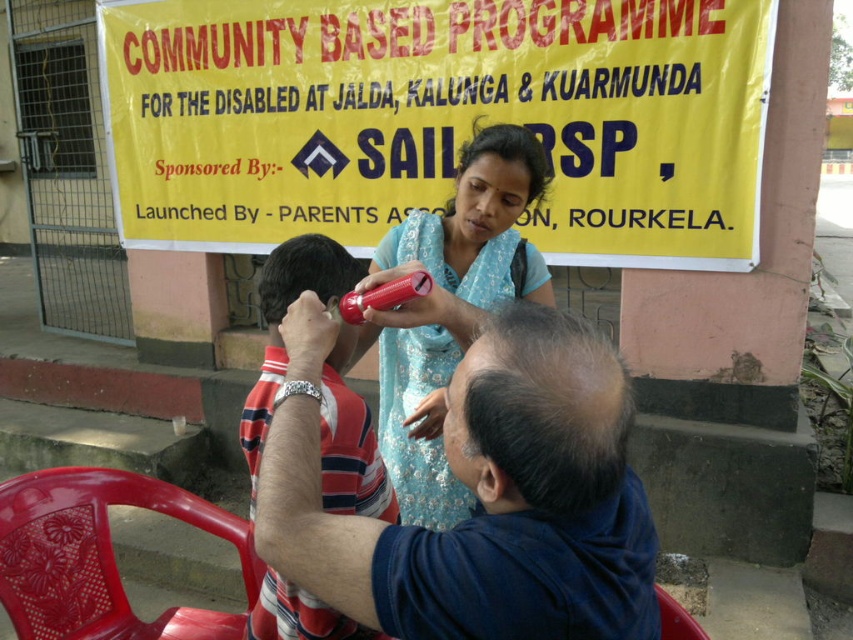
You are a healthcare worker setting up a station for a health screening event. You have a smooth plastic comb at center and a plastic chair at lower right. Which item should you place closer to the edge of the table to ensure it doesn not fall off?

The plastic chair at lower right should be placed closer to the edge because the smooth plastic comb at center might be wider and thus more stable if placed near the edge, reducing the risk of it falling off.

You are standing in the scene and want to read the yellow paper sign at upper center. Can you reach it without moving your position?

The yellow paper sign at upper center is 2.72 meters from viewer, so you can reach it without moving your position if you can extend your arm or move closer. However, based on the distance provided, it is 2.72 meters away, which might require moving closer to read it clearly.